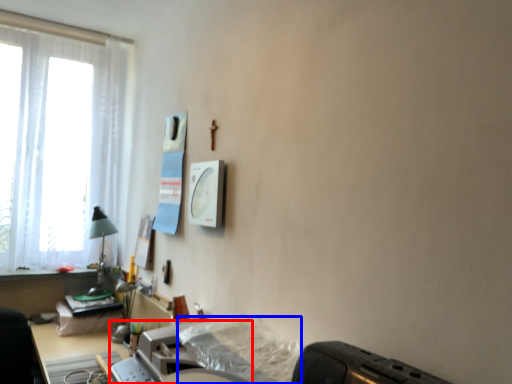
Question: Which object is further to the camera taking this photo, printer (highlighted by a red box) or sheet (highlighted by a blue box)?

Choices:
 (A) printer
 (B) sheet

Answer: (A)